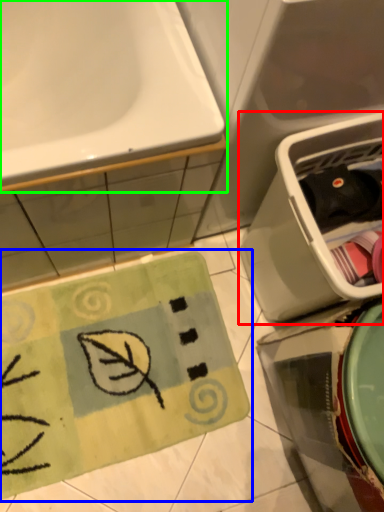
Question: Which is nearer to the dish washer (highlighted by a red box)? doormat (highlighted by a blue box) or sink (highlighted by a green box).

Choices:
 (A) doormat
 (B) sink

Answer: (B)